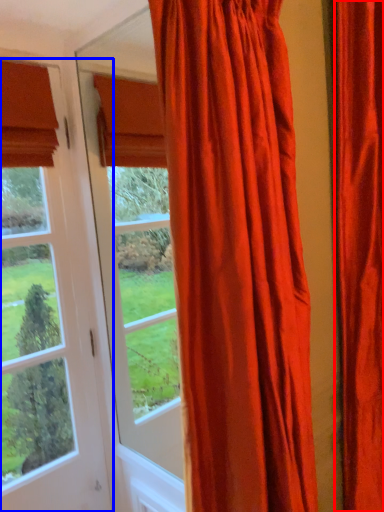
Question: Which point is further to the camera, curtain (highlighted by a red box) or window (highlighted by a blue box)?

Choices:
 (A) curtain
 (B) window

Answer: (B)